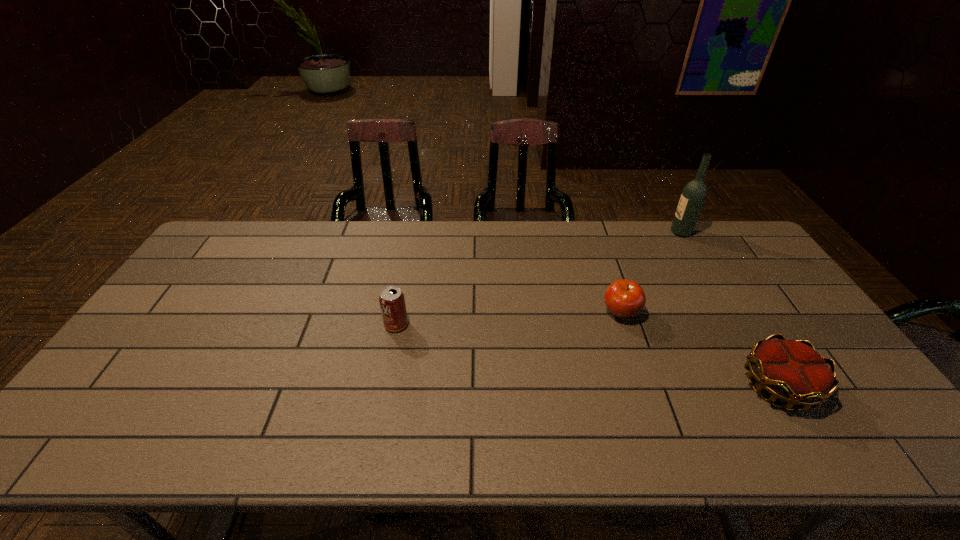
I want to click on free space between the leftmost object and the apple, so click(509, 319).

This screenshot has width=960, height=540. Find the location of `vacant space that is in between the second object from left to right and the soda can`. vacant space that is in between the second object from left to right and the soda can is located at coordinates (509, 319).

Find the location of a particular element. This screenshot has height=540, width=960. free point between the tallest object and the soda can is located at coordinates (539, 279).

Find the location of `vacant area between the third object from right to left and the nearest object`. vacant area between the third object from right to left and the nearest object is located at coordinates (700, 349).

What are the coordinates of `free space between the leftmost object and the crown` in the screenshot? It's located at (588, 355).

At what (x,y) coordinates should I click in order to perform the action: click on vacant space that is in between the nearest object and the soda can. Please return your answer as a coordinate pair (x, y). This screenshot has height=540, width=960. Looking at the image, I should click on (588, 355).

Identify the location of object that is the second nearest to the nearest object. The image size is (960, 540). (693, 196).

Identify which object is the nearest to the leftmost object. Please provide its 2D coordinates. Your answer should be formatted as a tuple, i.e. [(x, y)], where the tuple contains the x and y coordinates of a point satisfying the conditions above.

[(623, 298)]

Identify the location of vacant space that satisfies the following two spatial constraints: 1. on the back side of the leftmost object; 2. on the left side of the second object from left to right. This screenshot has height=540, width=960. (398, 313).

This screenshot has height=540, width=960. I want to click on vacant space that satisfies the following two spatial constraints: 1. on the front side of the nearest object; 2. on the right side of the second object from left to right, so click(x=645, y=386).